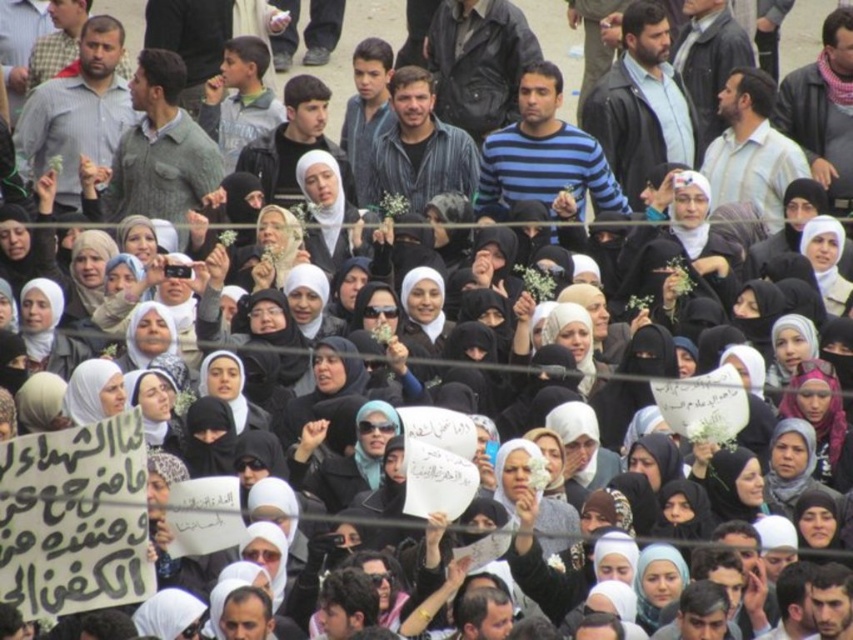
You are a photographer at the event and want to capture a closeup of the white fabric headscarf at center. Your camera is currently focused on point (273, 248). Is this point on the white fabric headscarf at center?

Yes, the point (273, 248) is on the white fabric headscarf at center according to the description.

Looking at this image, you are a photographer trying to capture both the white fabric headscarf at lower left and the matte black hijab at center in a single shot. Which of these two items is closer to your camera?

The white fabric headscarf at lower left is closer to the camera than the matte black hijab at center because it is further to the viewer.

You are a photographer standing at the center of the crowd, and you want to capture both the point at coordinates (32, 301) and the point at coordinates (265, 268) in your photo. Which point will appear larger in your photo?

Point at coordinates (32, 301) will appear larger in the photo because it is closer to the camera than point at coordinates (265, 268).